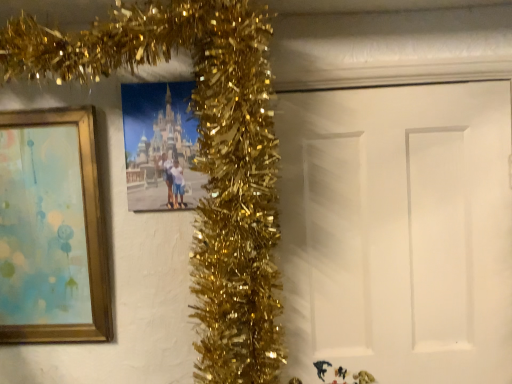
Question: From the image's perspective, is white matte door at center located above or below gold wood picture frame at left, which is the 1th picture frame from left to right?

Choices:
 (A) above
 (B) below

Answer: (B)

Question: Is point (332, 172) positioned closer to the camera than point (77, 228)?

Choices:
 (A) farther
 (B) closer

Answer: (A)

Question: Which of these objects is positioned farthest from the gold wood picture frame at left, the second picture frame from the right?

Choices:
 (A) matte plastic photo frame at center, positioned as the second picture frame in left-to-right order
 (B) white matte door at center

Answer: (B)

Question: Which object is positioned farthest from the white matte door at center?

Choices:
 (A) gold wood picture frame at left, the second picture frame from the right
 (B) matte plastic photo frame at center, positioned as the second picture frame in left-to-right order

Answer: (A)